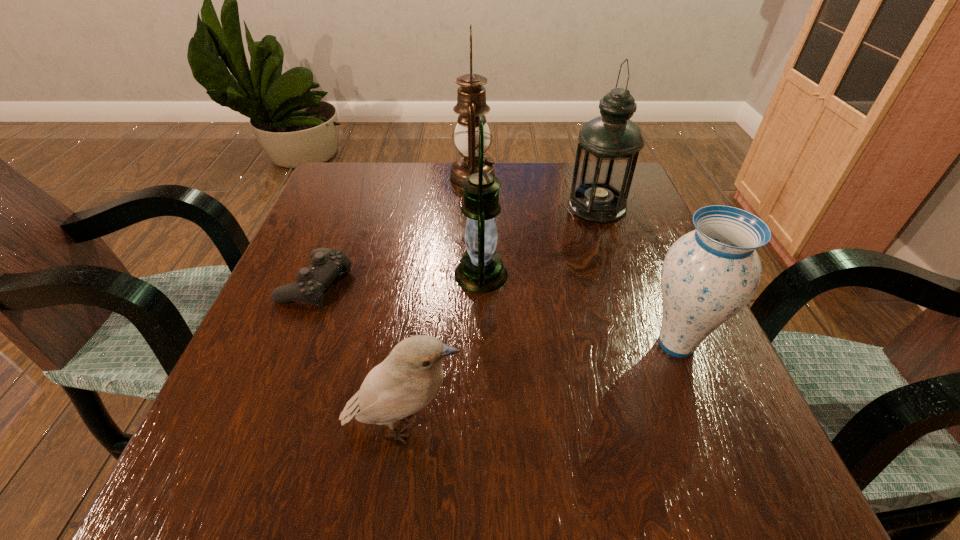
I want to click on the second closest object to the lantern, so click(x=326, y=264).

Locate an element on the screen. blank space that satisfies the following two spatial constraints: 1. on the side where the vase emits light; 2. on the left side of the lantern is located at coordinates (481, 344).

Find the location of a particular element. This screenshot has height=540, width=960. vacant point that satisfies the following two spatial constraints: 1. on the side where the lantern emits light; 2. on the front side of the control is located at coordinates (481, 282).

I want to click on free point that satisfies the following two spatial constraints: 1. on the side where the third shortest object emits light; 2. on the right side of the lantern, so click(481, 344).